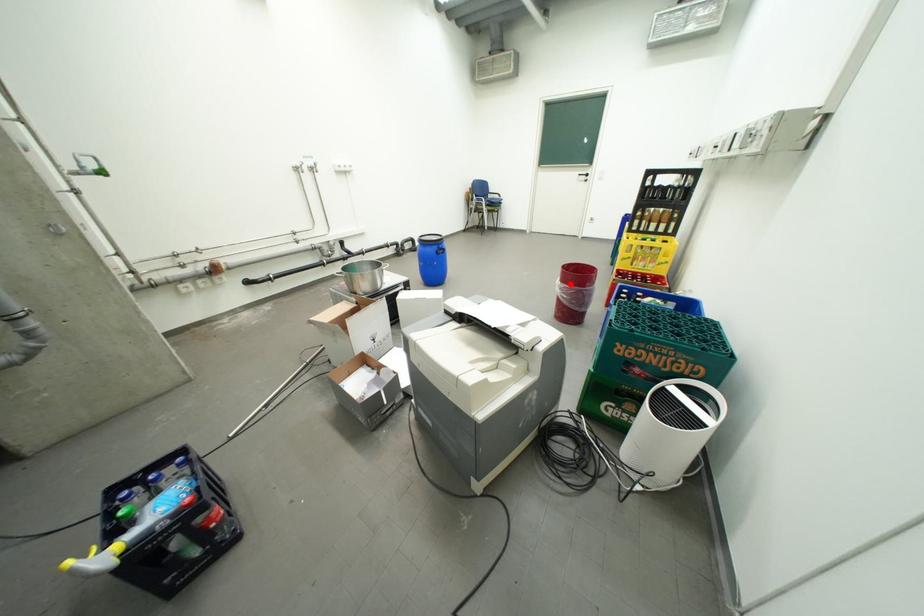
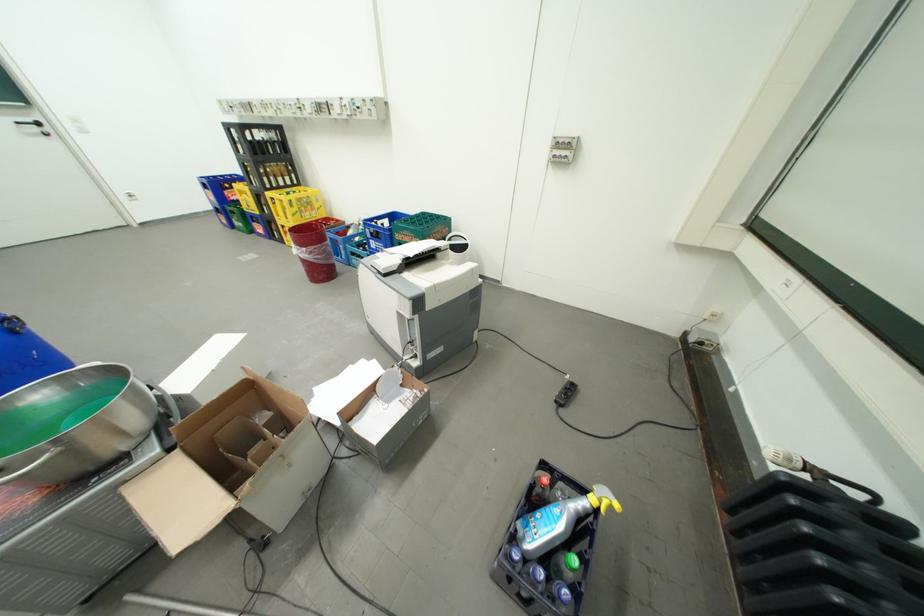
Locate, in the second image, the point that corresponds to the highlighted location in the first image.

(314, 249)